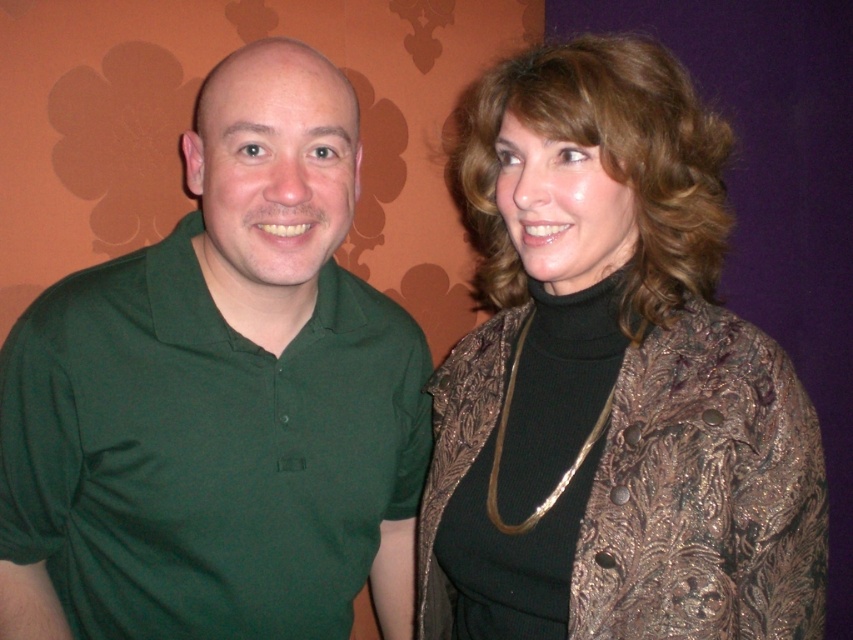
Can you confirm if shiny bronze jacket at center is positioned above green matte shirt at left?

Yes, shiny bronze jacket at center is above green matte shirt at left.

Can you confirm if shiny bronze jacket at center is positioned to the left of green matte shirt at left?

Incorrect, shiny bronze jacket at center is not on the left side of green matte shirt at left.

Is point (799, 547) positioned in front of point (347, 220)?

Yes, point (799, 547) is in front of point (347, 220).

The width and height of the screenshot is (853, 640). Find the location of `shiny bronze jacket at center`. shiny bronze jacket at center is located at coordinates (611, 378).